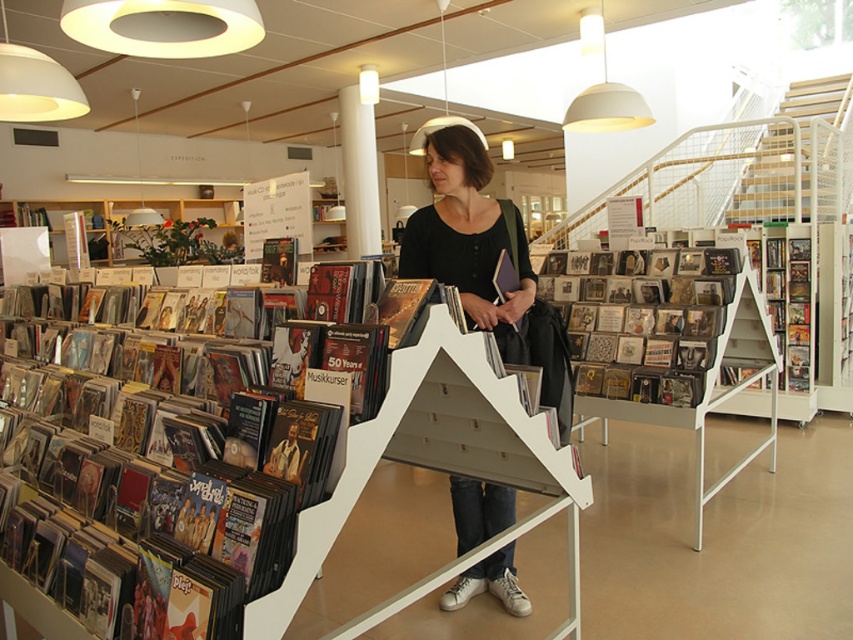
Question: Can you confirm if black matte shirt at center is positioned to the right of clear plastic cd at center?

Choices:
 (A) no
 (B) yes

Answer: (A)

Question: Considering the real-world distances, which object is farthest from the matte black vinyl records at left?

Choices:
 (A) white wooden stairs at upper center
 (B) matte black book at center

Answer: (A)

Question: Is matte black vinyl records at left to the left of white smooth pillar at center from the viewer's perspective?

Choices:
 (A) yes
 (B) no

Answer: (A)

Question: Which point is farther from the camera taking this photo?

Choices:
 (A) (56, 452)
 (B) (621, 339)

Answer: (B)

Question: Does clear plastic cd at center have a greater width compared to white smooth pillar at center?

Choices:
 (A) no
 (B) yes

Answer: (B)

Question: Among these objects, which one is nearest to the camera?

Choices:
 (A) matte black vinyl records at left
 (B) matte black book at center
 (C) white wooden stairs at upper center
 (D) white smooth pillar at center

Answer: (A)